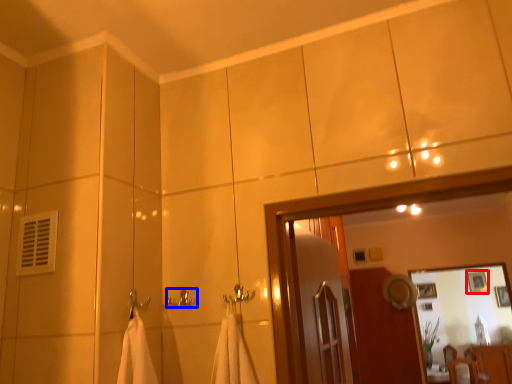
Question: Which object is further to the camera taking this photo, picture frame (highlighted by a red box) or towel bar (highlighted by a blue box)?

Choices:
 (A) picture frame
 (B) towel bar

Answer: (A)